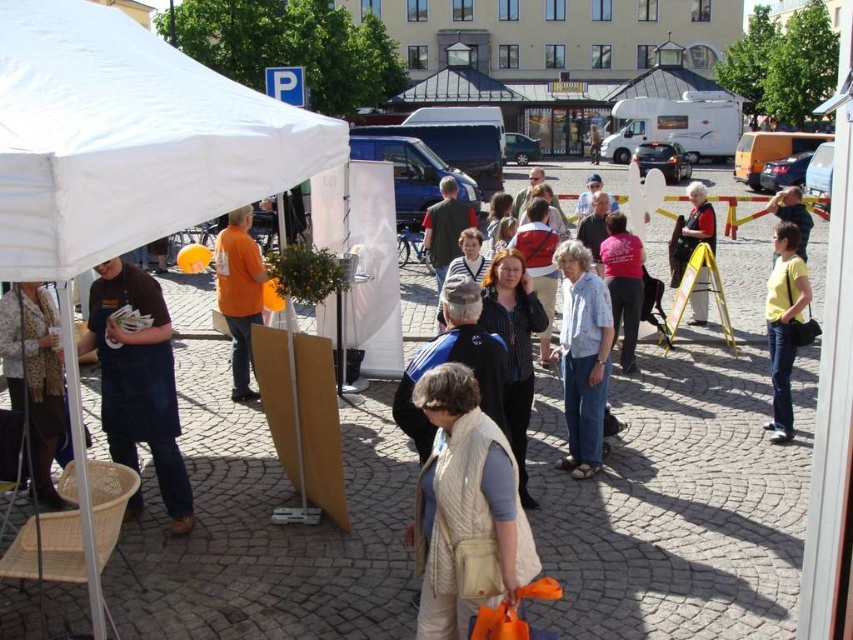
Looking at this image, you are a customer at the outdoor market and want to buy the beige quilted vest at center. Where exactly should you look to find it?

The beige quilted vest at center is located at point (x=465, y=509).

You are a customer at the market and want to buy a beige quilted vest at center and a yellow cotton shirt at right. Which clothing item is shorter in height?

The beige quilted vest at center has a lesser height compared to the yellow cotton shirt at right, so the beige quilted vest at center is shorter in height.

You are a customer at the market and see both the brown apron at left and the matte black jacket at center. Which clothing item is positioned closer to the left side of the scene?

The brown apron at left is positioned to the left of the matte black jacket at center, so it is closer to the left side of the scene.